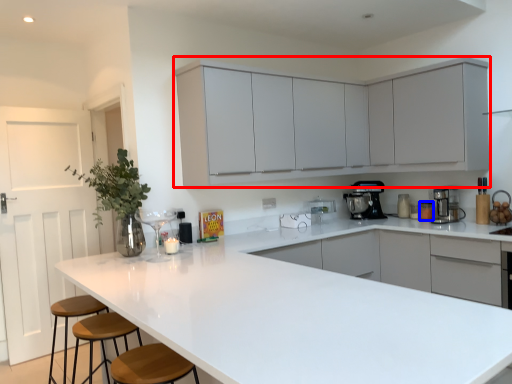
Question: Among these objects, which one is nearest to the camera, cabinetry (highlighted by a red box) or appliance (highlighted by a blue box)?

Choices:
 (A) cabinetry
 (B) appliance

Answer: (A)